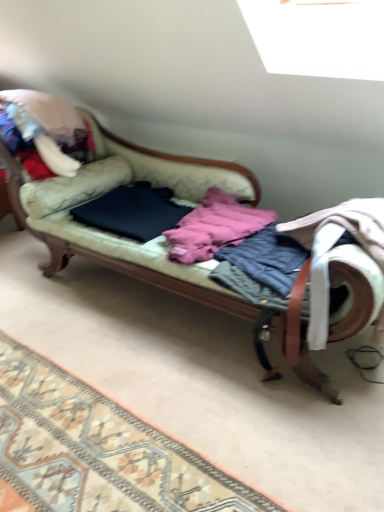
This screenshot has width=384, height=512. What are the coordinates of `vacant location behind patterned carpet at lower left` in the screenshot? It's located at (112, 331).